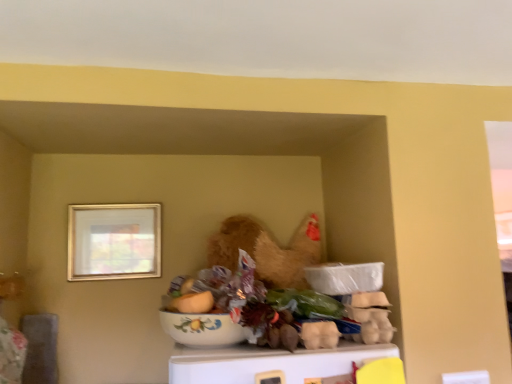
Question: From the image's perspective, is white glossy bowl at center beneath floral ceramic bowl at center, which ranks as the first food in top-to-bottom order?

Choices:
 (A) yes
 (B) no

Answer: (A)

Question: Is the depth of white glossy bowl at center greater than that of floral ceramic bowl at center, the 2th food in the bottom-to-top sequence?

Choices:
 (A) no
 (B) yes

Answer: (A)

Question: Does white glossy bowl at center appear on the left side of floral ceramic bowl at center, which is the second food from right to left?

Choices:
 (A) yes
 (B) no

Answer: (B)

Question: Is white glossy bowl at center closer to camera compared to floral ceramic bowl at center, which ranks as the first food in top-to-bottom order?

Choices:
 (A) no
 (B) yes

Answer: (B)

Question: Is white glossy bowl at center completely or partially outside of floral ceramic bowl at center, the 2th food in the bottom-to-top sequence?

Choices:
 (A) no
 (B) yes

Answer: (B)

Question: Is white glossy bowl at center not near floral ceramic bowl at center, which is the second food from right to left?

Choices:
 (A) no
 (B) yes

Answer: (A)

Question: From a real-world perspective, is floral ceramic bowl at center, which is the second food from right to left, over white cardboard egg carton at center, positioned as the second food in left-to-right order?

Choices:
 (A) no
 (B) yes

Answer: (B)

Question: Can we say floral ceramic bowl at center, which ranks as the first food in top-to-bottom order, lies outside white cardboard egg carton at center, positioned as the first food in bottom-to-top order?

Choices:
 (A) yes
 (B) no

Answer: (A)

Question: Is floral ceramic bowl at center, which ranks as the first food in top-to-bottom order, at the left side of white cardboard egg carton at center, the 2th food in the top-to-bottom sequence?

Choices:
 (A) no
 (B) yes

Answer: (B)

Question: Is floral ceramic bowl at center, which is the second food from right to left, in contact with white cardboard egg carton at center, positioned as the second food in left-to-right order?

Choices:
 (A) yes
 (B) no

Answer: (B)

Question: From a real-world perspective, is floral ceramic bowl at center, the 2th food in the bottom-to-top sequence, beneath white cardboard egg carton at center, which is the 1th food from right to left?

Choices:
 (A) yes
 (B) no

Answer: (B)

Question: Is floral ceramic bowl at center, the 2th food in the bottom-to-top sequence, facing towards white cardboard egg carton at center, positioned as the second food in left-to-right order?

Choices:
 (A) no
 (B) yes

Answer: (A)

Question: Does floral ceramic bowl at center, which ranks as the first food in top-to-bottom order, have a lesser width compared to gold metallic picture frame at upper left?

Choices:
 (A) yes
 (B) no

Answer: (B)